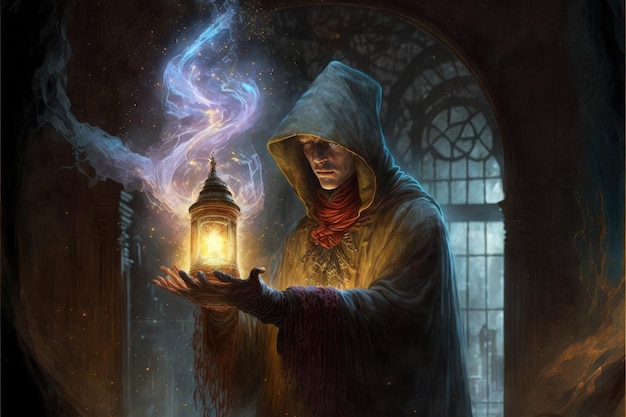
Where is `window`? The height and width of the screenshot is (417, 626). window is located at coordinates (474, 283).